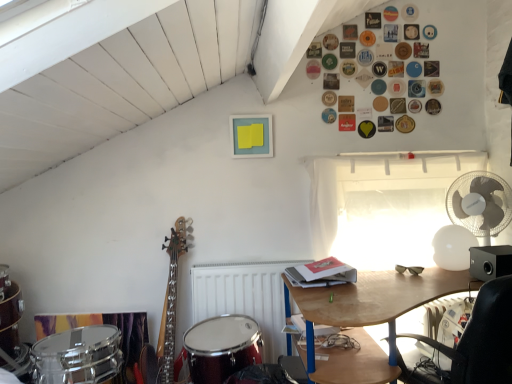
Where is `free point to the left of matte black sunglasses at center right`? This screenshot has width=512, height=384. free point to the left of matte black sunglasses at center right is located at coordinates (377, 273).